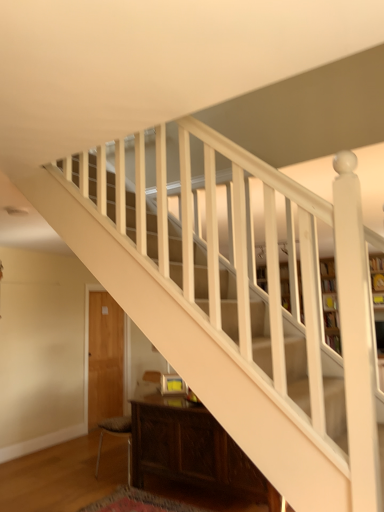
Where is `dark brown leather armchair at lower left`? Image resolution: width=384 pixels, height=512 pixels. dark brown leather armchair at lower left is located at coordinates (118, 436).

Locate an element on the screen. The image size is (384, 512). dark brown leather armchair at lower left is located at coordinates (118, 436).

Can dark brown leather armchair at lower left be found inside white wood bookcase at center?

Actually, dark brown leather armchair at lower left is outside white wood bookcase at center.

Is white wood bookcase at center aimed at dark brown leather armchair at lower left?

Yes, white wood bookcase at center is oriented towards dark brown leather armchair at lower left.

The image size is (384, 512). In order to click on armchair directly beneath the white wood bookcase at center (from a real-world perspective) in this screenshot , I will do `click(118, 436)`.

Is white wood bookcase at center wider or thinner than dark brown leather armchair at lower left?

white wood bookcase at center is thinner than dark brown leather armchair at lower left.

Is dark wood cabinet at lower center spatially inside white wood bookcase at center, or outside of it?

dark wood cabinet at lower center is outside white wood bookcase at center.

Does dark wood cabinet at lower center have a lesser width compared to white wood bookcase at center?

No.

Is dark wood cabinet at lower center placed right next to white wood bookcase at center?

dark wood cabinet at lower center and white wood bookcase at center are clearly separated.

From the picture: Between dark wood cabinet at lower center and white wood bookcase at center, which one appears on the right side from the viewer's perspective?

Positioned to the right is white wood bookcase at center.

Between point (128, 466) and point (284, 260), which one is positioned behind?

Positioned behind is point (128, 466).

Looking at this image, is dark brown leather armchair at lower left oriented towards white wood bookcase at center?

No, dark brown leather armchair at lower left is not oriented towards white wood bookcase at center.

Is dark brown leather armchair at lower left to the right of white wood bookcase at center from the viewer's perspective?

In fact, dark brown leather armchair at lower left is to the left of white wood bookcase at center.

Considering the sizes of objects dark brown leather armchair at lower left and white wood bookcase at center in the image provided, who is bigger, dark brown leather armchair at lower left or white wood bookcase at center?

Bigger between the two is white wood bookcase at center.

From a real-world perspective, between dark brown leather armchair at lower left and dark wood cabinet at lower center, who is vertically lower?

dark wood cabinet at lower center is physically lower.

Does dark brown leather armchair at lower left have a greater height compared to dark wood cabinet at lower center?

Correct, dark brown leather armchair at lower left is much taller as dark wood cabinet at lower center.

Which object is positioned more to the left, dark brown leather armchair at lower left or dark wood cabinet at lower center?

Positioned to the left is dark brown leather armchair at lower left.

Find the location of a particular element. The height and width of the screenshot is (512, 384). armchair to the left of dark wood cabinet at lower center is located at coordinates (118, 436).

Considering their positions, is dark wood cabinet at lower center located in front of or behind dark brown leather armchair at lower left?

dark wood cabinet at lower center is positioned closer to the viewer than dark brown leather armchair at lower left.

Is dark wood cabinet at lower center touching dark brown leather armchair at lower left?

There is a gap between dark wood cabinet at lower center and dark brown leather armchair at lower left.

Find the location of `armchair above the dark wood cabinet at lower center (from a real-world perspective)`. armchair above the dark wood cabinet at lower center (from a real-world perspective) is located at coordinates (118, 436).

Between point (293, 323) and point (216, 451), which one is positioned in front?

Positioned in front is point (293, 323).

From the image's perspective, is white wood bookcase at center positioned above or below dark wood cabinet at lower center?

white wood bookcase at center is above dark wood cabinet at lower center.

Between white wood bookcase at center and dark wood cabinet at lower center, which one has larger width?

dark wood cabinet at lower center is wider.

Where is `armchair below the white wood bookcase at center (from the image's perspective)`? armchair below the white wood bookcase at center (from the image's perspective) is located at coordinates (118, 436).

What are the coordinates of `table in front of the white wood bookcase at center` in the screenshot? It's located at (192, 450).

When comparing their distances from dark wood cabinet at lower center, does dark brown leather armchair at lower left or white wood bookcase at center seem closer?

dark brown leather armchair at lower left is closer to dark wood cabinet at lower center.

Considering their positions, is dark wood cabinet at lower center positioned further to dark brown leather armchair at lower left than white wood bookcase at center?

white wood bookcase at center is further to dark brown leather armchair at lower left.

Considering their positions, is white wood bookcase at center positioned closer to dark brown leather armchair at lower left than dark wood cabinet at lower center?

dark wood cabinet at lower center.

Based on their spatial positions, is dark wood cabinet at lower center or dark brown leather armchair at lower left closer to white wood bookcase at center?

dark wood cabinet at lower center is closer to white wood bookcase at center.

Considering their positions, is dark brown leather armchair at lower left positioned further to white wood bookcase at center than dark wood cabinet at lower center?

dark brown leather armchair at lower left is further to white wood bookcase at center.

Looking at the image, which one is located further to dark wood cabinet at lower center, white wood bookcase at center or dark brown leather armchair at lower left?

The object further to dark wood cabinet at lower center is white wood bookcase at center.

I want to click on armchair between dark wood cabinet at lower center and white wood bookcase at center along the z-axis, so click(x=118, y=436).